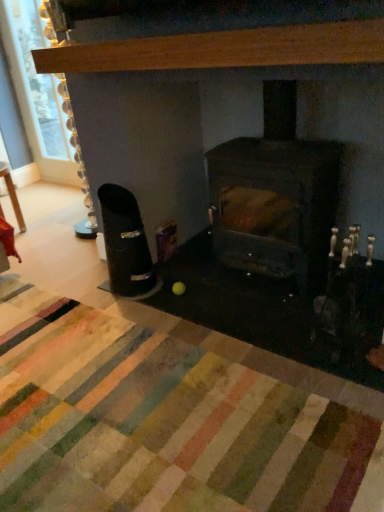
Find the location of a particular element. The image size is (384, 512). vacant space positioned to the left of black plastic ashtray at left is located at coordinates (86, 293).